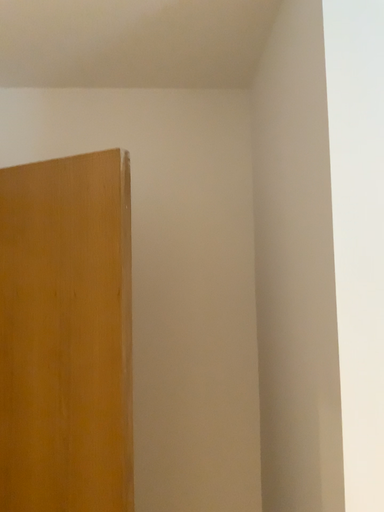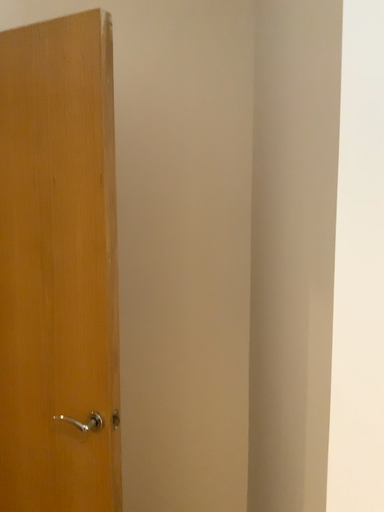
Question: How did the camera likely rotate when shooting the video?

Choices:
 (A) rotated upward
 (B) rotated downward

Answer: (B)